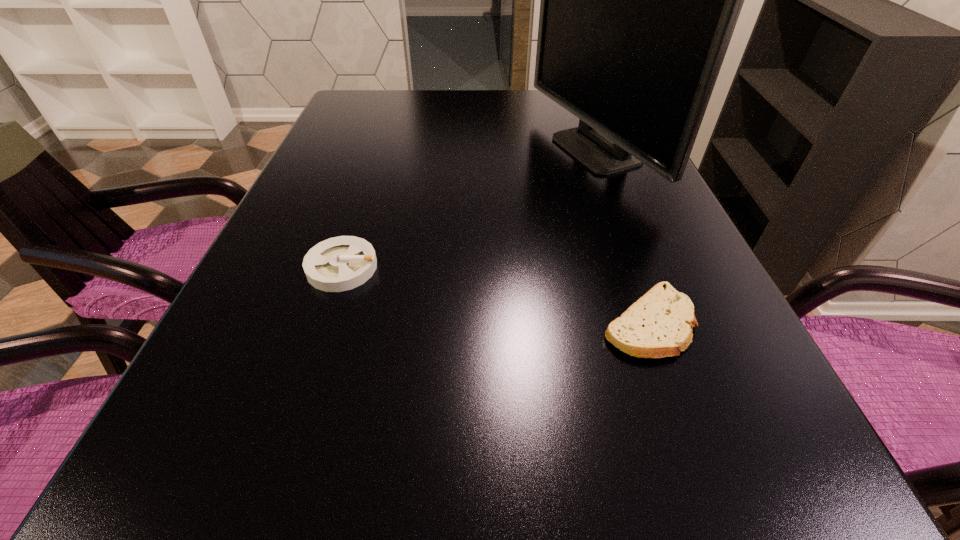
The height and width of the screenshot is (540, 960). In order to click on object present at the far edge in this screenshot , I will do `click(639, 0)`.

Find the location of a particular element. Image resolution: width=960 pixels, height=540 pixels. object that is at the left edge is located at coordinates (337, 264).

The width and height of the screenshot is (960, 540). In order to click on computer monitor present at the right edge in this screenshot , I will do `click(639, 0)`.

Locate an element on the screen. Image resolution: width=960 pixels, height=540 pixels. pita bread that is at the right edge is located at coordinates (655, 326).

Identify the location of object that is at the far right corner. (639, 0).

Where is `vacant space at the far edge`? vacant space at the far edge is located at coordinates click(403, 97).

In the image, there is a desktop. Where is `vacant space at the near edge`? vacant space at the near edge is located at coordinates (551, 534).

Locate an element on the screen. The height and width of the screenshot is (540, 960). vacant space at the left edge is located at coordinates (326, 294).

Identify the location of vacant space at the right edge. (647, 231).

Locate an element on the screen. The image size is (960, 540). empty location between the shortest object and the ashtray is located at coordinates (495, 295).